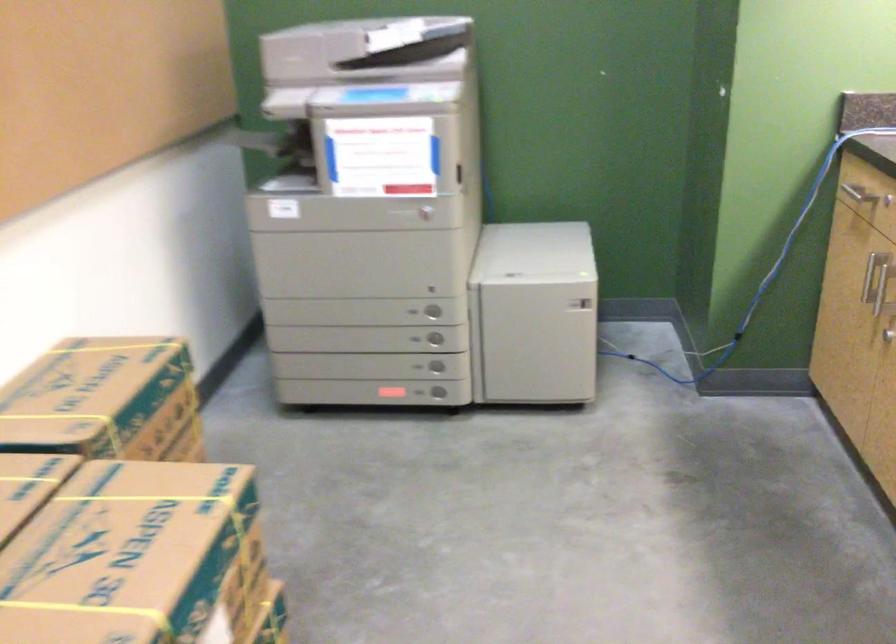
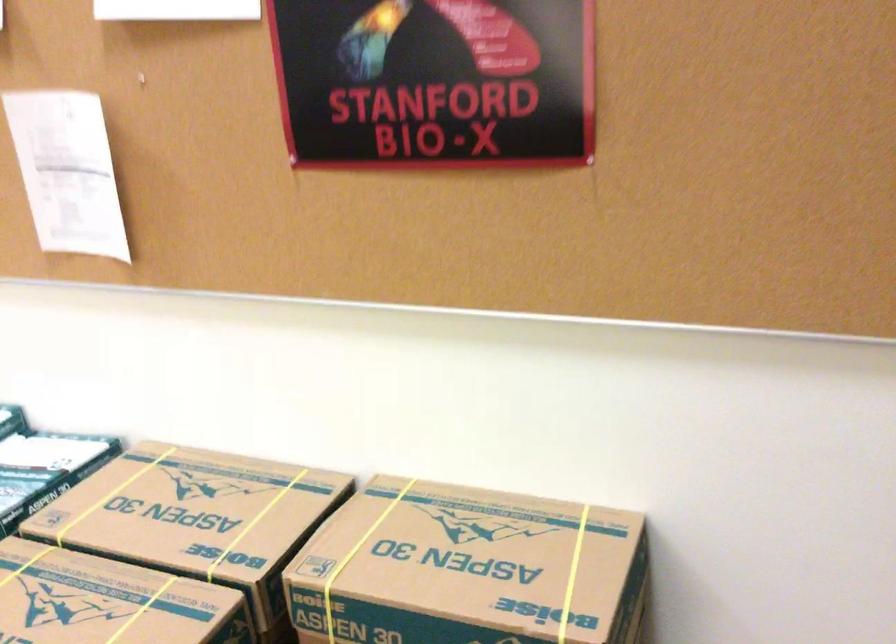
Locate, in the second image, the point that corresponds to point (135, 345) in the first image.

(572, 574)